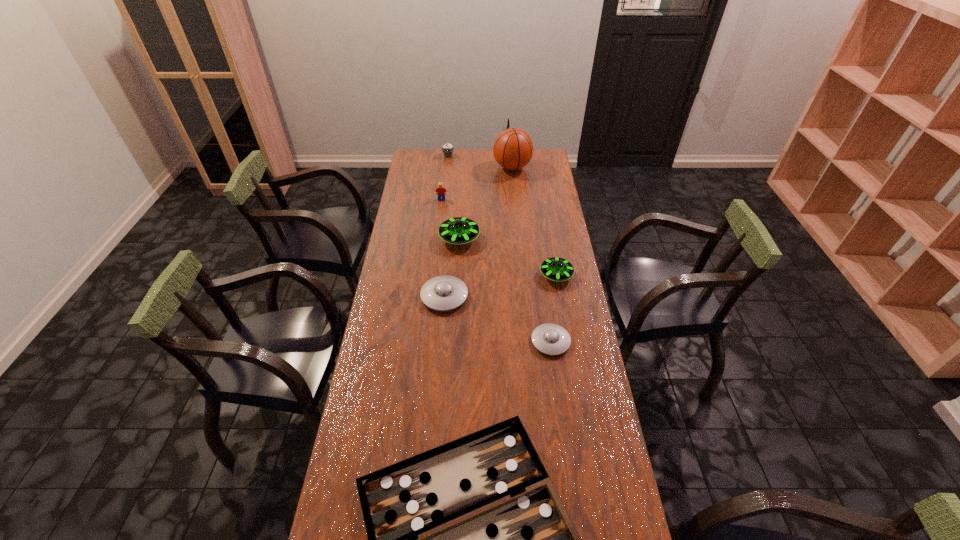
This screenshot has height=540, width=960. Identify the location of object that is positioned at the left edge. (442, 293).

Find the location of `basketball present at the right edge`. basketball present at the right edge is located at coordinates (513, 148).

You are a GUI agent. You are given a task and a screenshot of the screen. Output one action in this format:
    pyautogui.click(x=<x>, y=<y>)
    Task: Click on the object that is at the far right corner
    The width and height of the screenshot is (960, 540).
    Given the screenshot: What is the action you would take?
    pyautogui.click(x=513, y=148)

Image resolution: width=960 pixels, height=540 pixels. In the image, there is a desktop. Find the location of `free space at the far edge`. free space at the far edge is located at coordinates (471, 159).

Locate an element on the screen. The width and height of the screenshot is (960, 540). vacant space at the left edge is located at coordinates (431, 187).

In order to click on free space at the right edge of the desktop in this screenshot , I will do `click(563, 300)`.

The image size is (960, 540). In the image, there is a desktop. What are the coordinates of `free space at the far left corner` in the screenshot? It's located at (434, 150).

In the image, there is a desktop. Identify the location of free space at the far right corner. The width and height of the screenshot is (960, 540). (535, 151).

This screenshot has width=960, height=540. I want to click on free space between the farther green saucer and the cupcake, so click(x=454, y=197).

The height and width of the screenshot is (540, 960). I want to click on empty location between the nearer gray saucer and the left green saucer, so click(x=505, y=290).